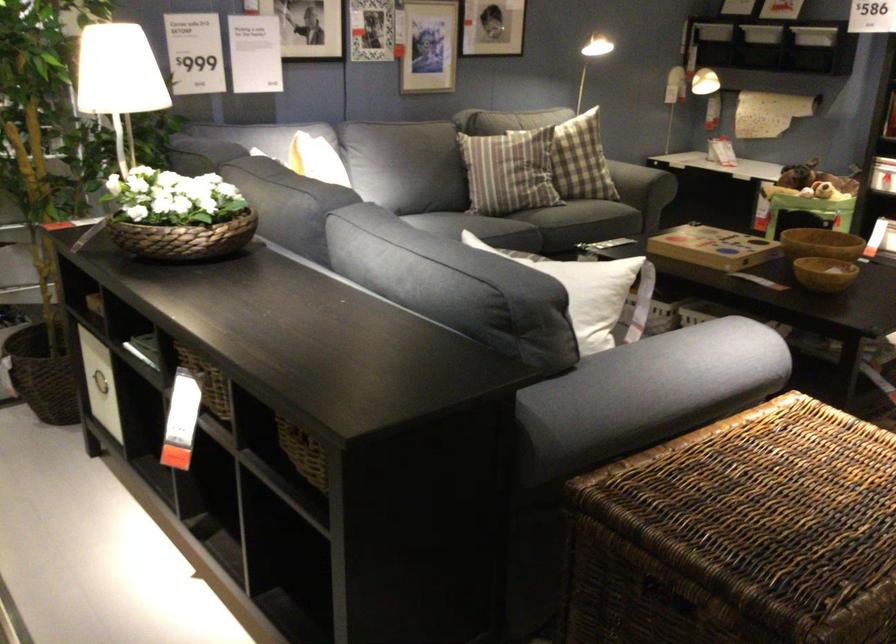
Where would you pull the white box handle? Please return your answer as a coordinate pair (x, y).

(99, 383)